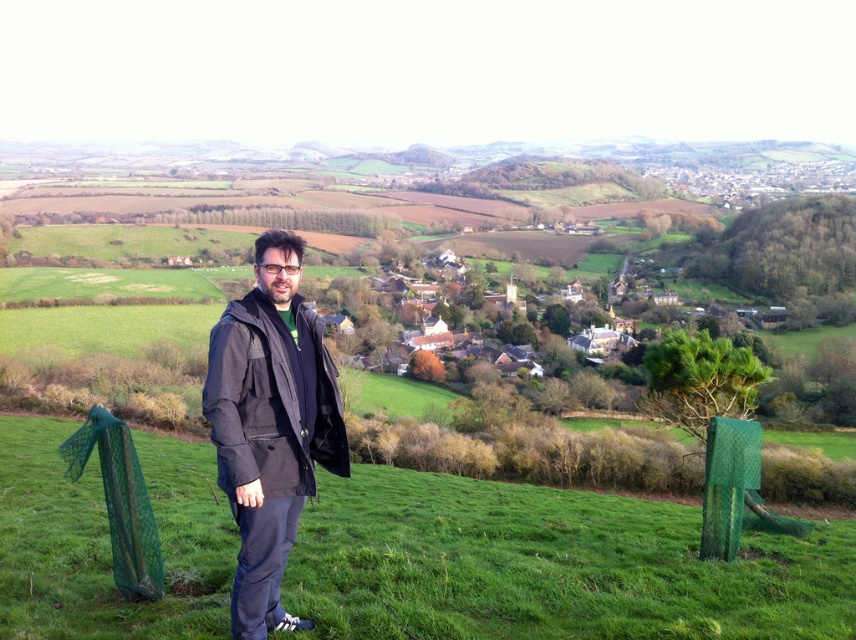
Question: Which point is farther to the camera?

Choices:
 (A) (496, 548)
 (B) (265, 234)

Answer: (A)

Question: In this image, where is green grassy at center located relative to dark gray fabric jacket at center?

Choices:
 (A) left
 (B) right

Answer: (A)

Question: Which point appears farthest from the camera in this image?

Choices:
 (A) (318, 353)
 (B) (93, 506)

Answer: (B)

Question: Is green grassy at center closer to camera compared to dark gray fabric jacket at center?

Choices:
 (A) no
 (B) yes

Answer: (A)

Question: Is green grassy at center further to camera compared to dark gray fabric jacket at center?

Choices:
 (A) yes
 (B) no

Answer: (A)